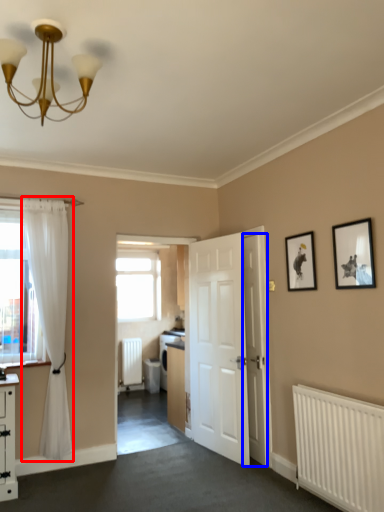
Question: Which object appears closest to the camera in this image, curtain (highlighted by a red box) or door (highlighted by a blue box)?

Choices:
 (A) curtain
 (B) door

Answer: (A)